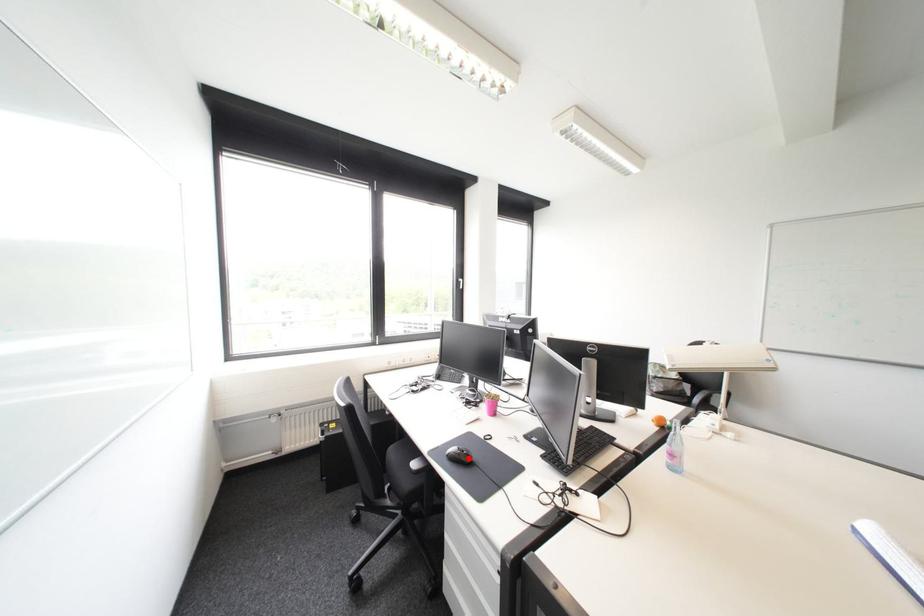
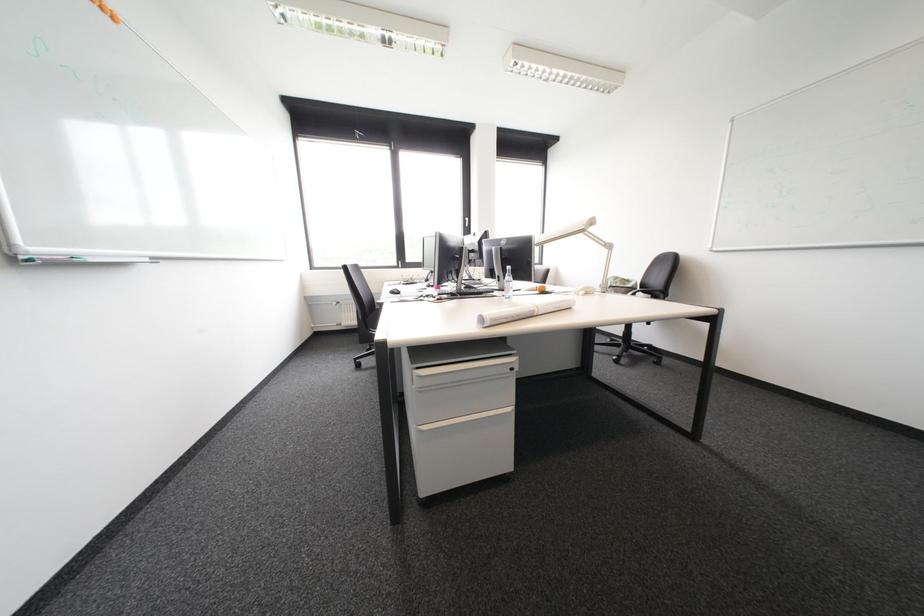
Question: I am providing you with two images of the same scene from different viewpoints. A red point is marked on the first image. At the location where the point appears in image 1, is it still visible in image 2?

Choices:
 (A) Yes
 (B) No

Answer: (B)